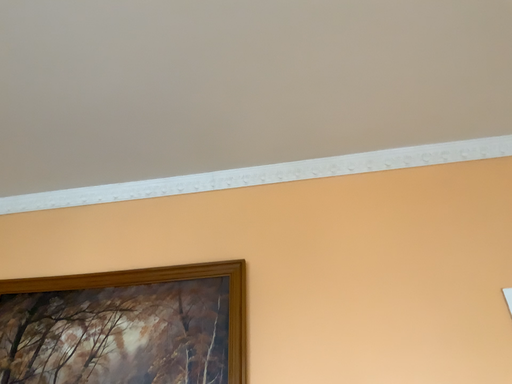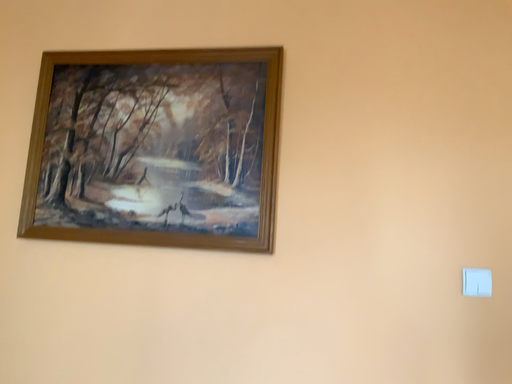
Question: How did the camera likely rotate when shooting the video?

Choices:
 (A) rotated downward
 (B) rotated upward

Answer: (A)